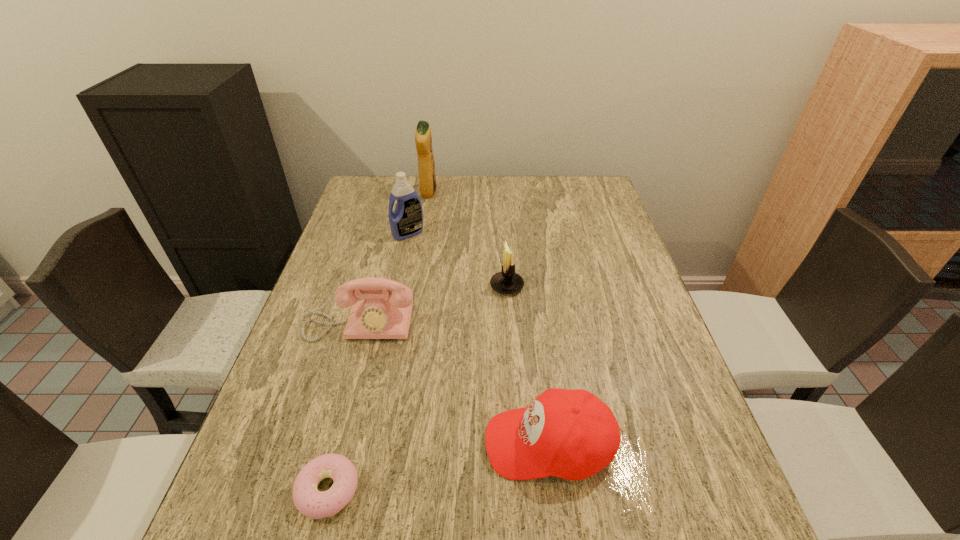
Find the location of `the taller detergent`. the taller detergent is located at coordinates (423, 139).

The image size is (960, 540). Identify the location of the farther detergent. (423, 139).

This screenshot has width=960, height=540. Identify the location of the shorter detergent. (406, 221).

Where is `the nearer detergent`? This screenshot has height=540, width=960. the nearer detergent is located at coordinates 406,221.

Where is `candle holder`? candle holder is located at coordinates (506, 282).

Locate an element on the screen. The image size is (960, 540). telephone is located at coordinates (383, 314).

You are a GUI agent. You are given a task and a screenshot of the screen. Output one action in this format:
    pyautogui.click(x=<x>, y=<y>)
    Task: Click on the second shortest object
    Image resolution: width=960 pixels, height=540 pixels.
    Given the screenshot: What is the action you would take?
    pyautogui.click(x=571, y=434)

Where is `the shortest object`? Image resolution: width=960 pixels, height=540 pixels. the shortest object is located at coordinates (310, 502).

Where is `free space located on the label of the farthest object`? free space located on the label of the farthest object is located at coordinates (476, 192).

The width and height of the screenshot is (960, 540). I want to click on vacant region located on the right of the nearer detergent, so click(x=503, y=233).